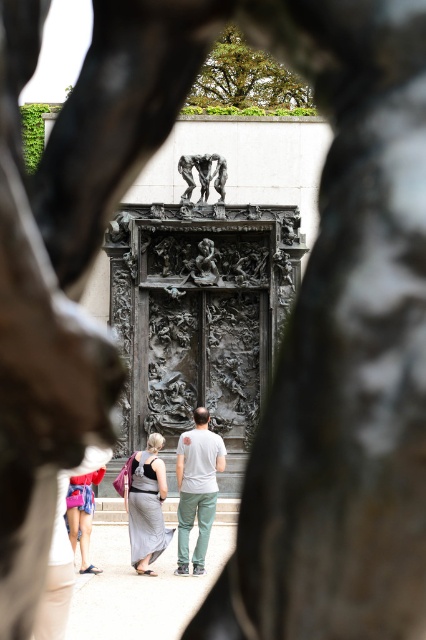
Question: Based on their relative distances, which object is nearer to the matte gray t-shirt at center?

Choices:
 (A) matte gray dress at center
 (B) polished bronze sculpture at center
 (C) silvery metallic dress at center

Answer: (A)

Question: Is the position of matte gray t-shirt at center less distant than that of silvery metallic dress at center?

Choices:
 (A) yes
 (B) no

Answer: (A)

Question: Which point is farther from the camera taking this photo?

Choices:
 (A) (89, 493)
 (B) (218, 180)

Answer: (B)

Question: Which point appears farthest from the camera in this image?

Choices:
 (A) (215, 182)
 (B) (143, 476)
 (C) (78, 508)
 (D) (155, 522)

Answer: (A)

Question: Is matte gray dress at center bigger than silvery metallic dress at center?

Choices:
 (A) no
 (B) yes

Answer: (B)

Question: Does matte gray t-shirt at center lie behind denim shorts at lower left?

Choices:
 (A) no
 (B) yes

Answer: (A)